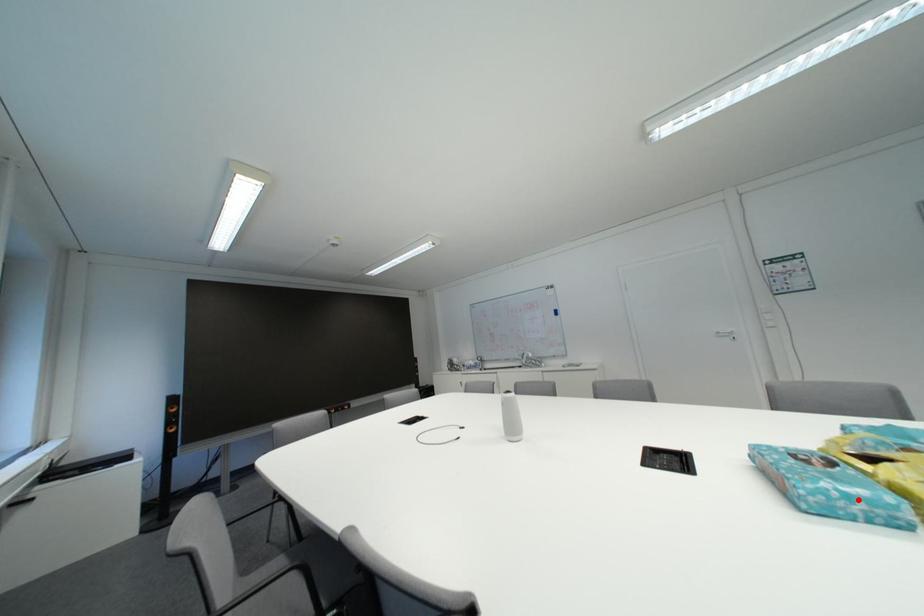
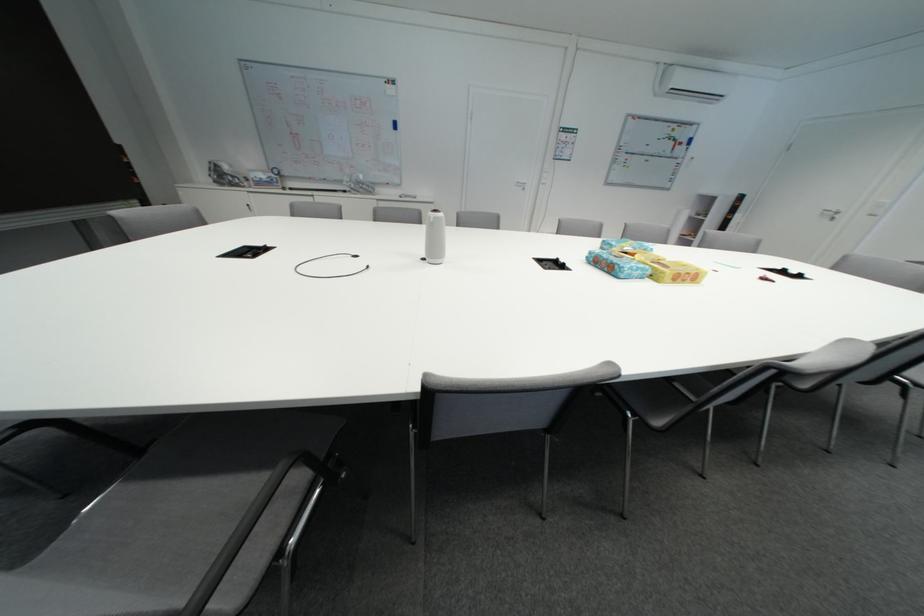
In the second image, find the point that corresponds to the highlighted location in the first image.

(648, 272)